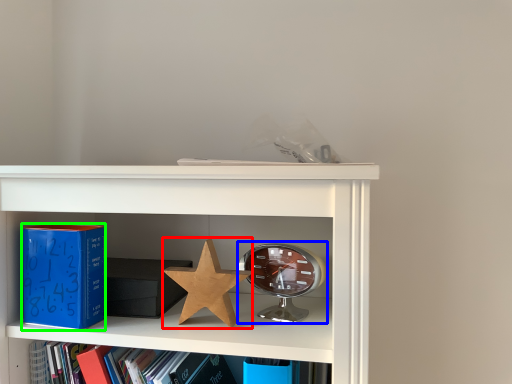
Question: Which object is positioned farthest from star (highlighted by a red box)? Select from alarm clock (highlighted by a blue box) and paperback book (highlighted by a green box).

Choices:
 (A) alarm clock
 (B) paperback book

Answer: (B)